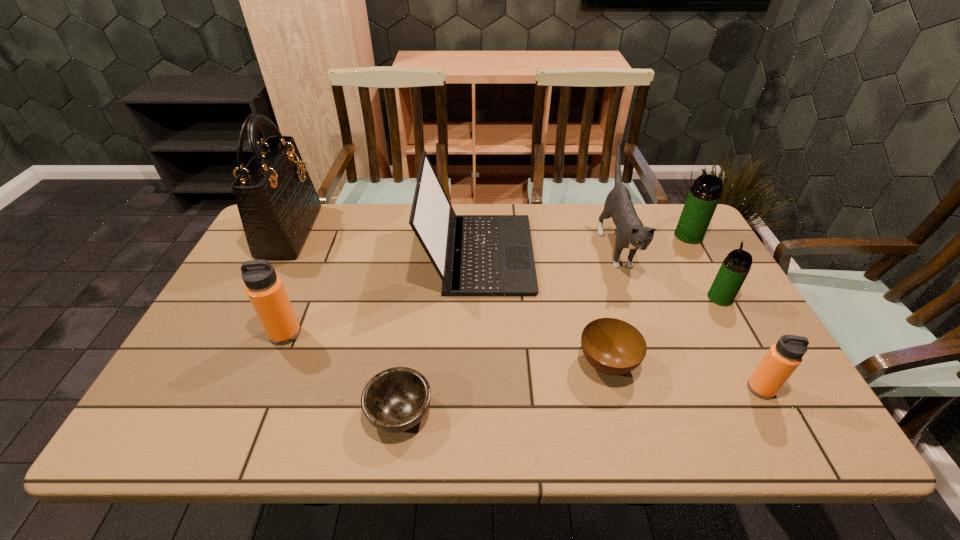
This screenshot has height=540, width=960. In order to click on the nearer orange thermos bottle in this screenshot , I will do `click(782, 359)`.

Find the location of a particular element. the right orange thermos bottle is located at coordinates (782, 359).

Where is `the fifth object from right to left`? The image size is (960, 540). the fifth object from right to left is located at coordinates (614, 347).

What are the coordinates of `the taller bowl` in the screenshot? It's located at pos(614,347).

You are a GUI agent. You are given a task and a screenshot of the screen. Output one action in this format:
    pyautogui.click(x=<x>, y=<y>)
    Task: Click on the shortest object
    
    Given the screenshot: What is the action you would take?
    pyautogui.click(x=396, y=399)

Identify the location of the left bowl. (396, 399).

What are the coordinates of `vacant space located at the front of the leftmost object with visible charms` in the screenshot? It's located at (346, 232).

This screenshot has width=960, height=540. Find the location of `free region located at the face of the fourth object from right to left`. free region located at the face of the fourth object from right to left is located at coordinates (648, 335).

The height and width of the screenshot is (540, 960). I want to click on vacant region located 0.130m on the surface of the laptop, so click(x=575, y=254).

You are a GUI agent. You are given a task and a screenshot of the screen. Output one action in this format:
    pyautogui.click(x=<x>, y=<y>)
    Task: Click on the vacant region located from the spout of the farthest thermos bottle
    
    Given the screenshot: What is the action you would take?
    pyautogui.click(x=590, y=235)